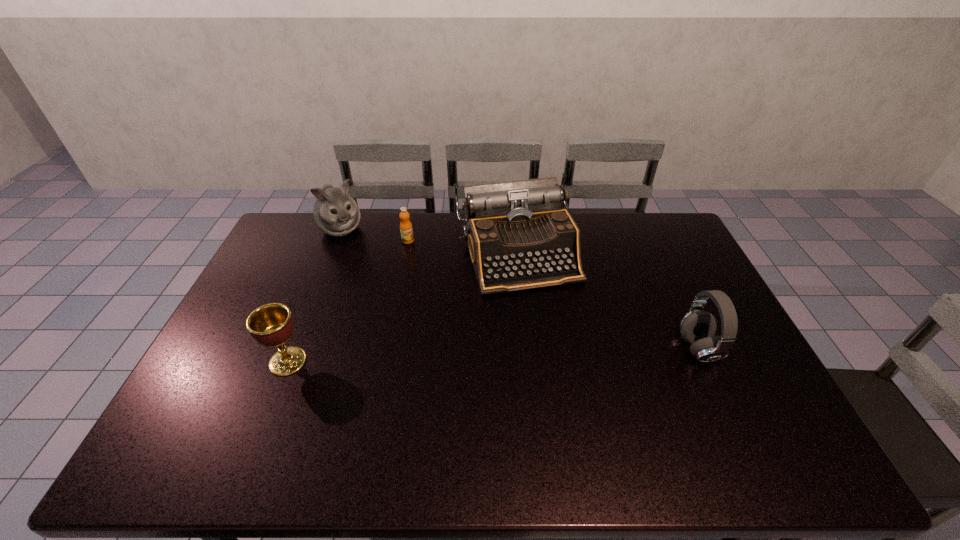
You are a GUI agent. You are given a task and a screenshot of the screen. Output one action in this format:
    pyautogui.click(x=<x>, y=<y>)
    Task: Click on the vacant area located 0.210m on the keyboard of the typewriter
    
    Given the screenshot: What is the action you would take?
    pyautogui.click(x=553, y=348)

Where is `vacant space located on the keyboard of the typewriter`? The width and height of the screenshot is (960, 540). vacant space located on the keyboard of the typewriter is located at coordinates (547, 334).

This screenshot has height=540, width=960. I want to click on vacant region located 0.310m on the keyboard of the typewriter, so click(x=564, y=376).

At what (x,y) coordinates should I click in order to perform the action: click on free space located on the front label of the third object from right to left. Please return your answer as a coordinate pair (x, y). Image resolution: width=960 pixels, height=540 pixels. Looking at the image, I should click on (458, 309).

Locate an element on the screen. The height and width of the screenshot is (540, 960). vacant space located 0.230m on the front label of the third object from right to left is located at coordinates (437, 281).

Locate an element on the screen. The height and width of the screenshot is (540, 960). free space located 0.390m on the front label of the third object from right to left is located at coordinates (459, 311).

You are a GUI agent. You are given a task and a screenshot of the screen. Output one action in this format:
    pyautogui.click(x=<x>, y=<y>)
    Task: Click on the free space located on the face of the hamster
    Image resolution: width=960 pixels, height=540 pixels.
    Given the screenshot: What is the action you would take?
    pyautogui.click(x=364, y=264)

Where is `free spot located on the face of the hamster`? free spot located on the face of the hamster is located at coordinates (381, 287).

You are a GUI agent. You are given a task and a screenshot of the screen. Output one action in this format:
    pyautogui.click(x=<x>, y=<y>)
    Task: Click on the free space located 0.130m on the face of the hamster
    The image size is (960, 540).
    Given the screenshot: What is the action you would take?
    pyautogui.click(x=362, y=261)

Identify the location of typewriter that is at the far edge. Image resolution: width=960 pixels, height=540 pixels. (519, 237).